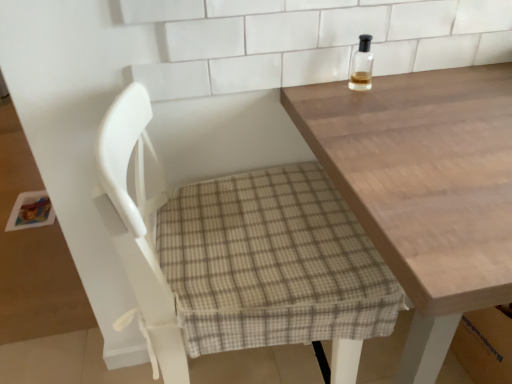
You are a GUI agent. You are given a task and a screenshot of the screen. Output one action in this format:
    pyautogui.click(x=<x>, y=<y>)
    Task: Click on the vacant space positioned to the left of clear glass bottle at upper right
    This screenshot has width=512, height=384.
    Given the screenshot: What is the action you would take?
    pyautogui.click(x=315, y=96)